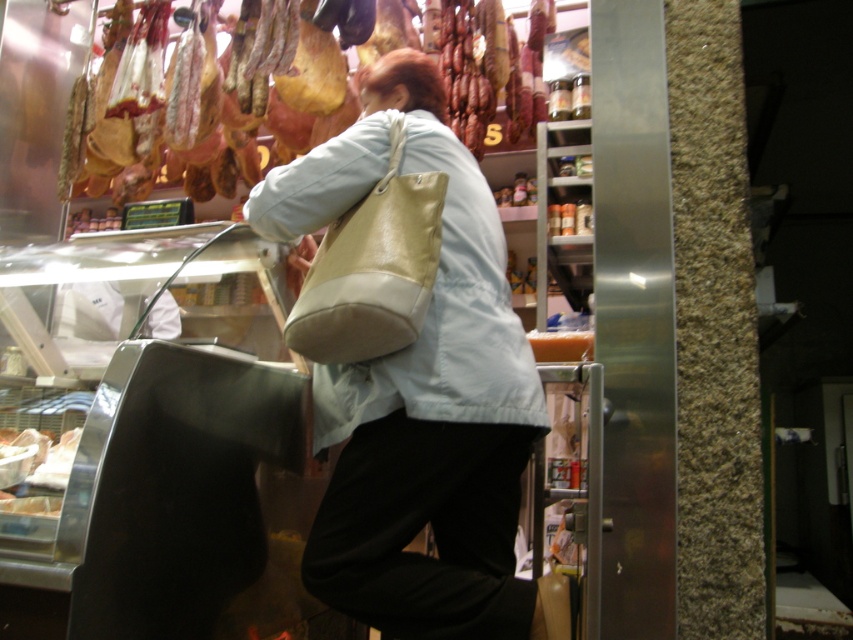
Question: Estimate the real-world distances between objects in this image. Which object is closer to the white glossy cheese at lower left?

Choices:
 (A) beige leather bag at center
 (B) matte brown cured meat at upper left

Answer: (A)

Question: Is beige leather bag at center further to camera compared to matte brown cured meat at upper left?

Choices:
 (A) yes
 (B) no

Answer: (B)

Question: Among these objects, which one is nearest to the camera?

Choices:
 (A) beige leather bag at center
 (B) white glossy cheese at lower left

Answer: (B)

Question: Is beige leather bag at center bigger than matte brown cured meat at upper left?

Choices:
 (A) yes
 (B) no

Answer: (B)

Question: Which of the following is the farthest from the observer?

Choices:
 (A) (53, 449)
 (B) (109, 10)
 (C) (338, 426)

Answer: (B)

Question: Can you confirm if beige leather bag at center is bigger than matte brown cured meat at upper left?

Choices:
 (A) yes
 (B) no

Answer: (B)